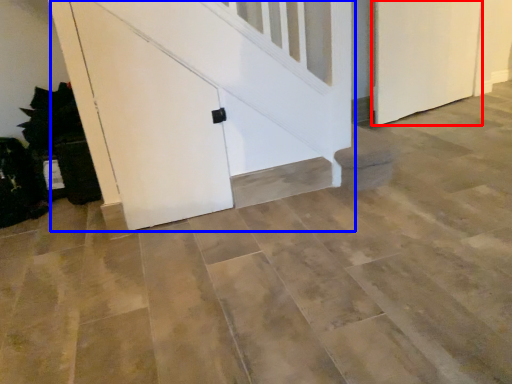
Question: Among these objects, which one is nearest to the camera, door (highlighted by a red box) or door (highlighted by a blue box)?

Choices:
 (A) door
 (B) door

Answer: (B)